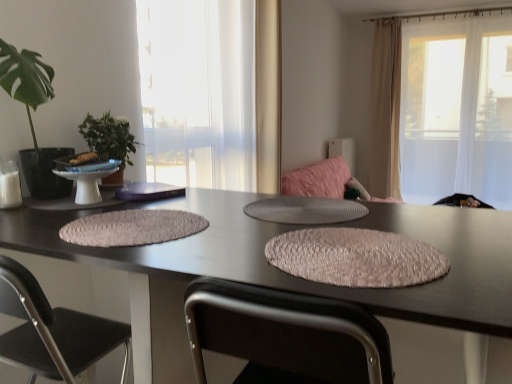
Where is `vacant area on top of matte black table at center (from a real-world perspective)`? This screenshot has width=512, height=384. vacant area on top of matte black table at center (from a real-world perspective) is located at coordinates (223, 223).